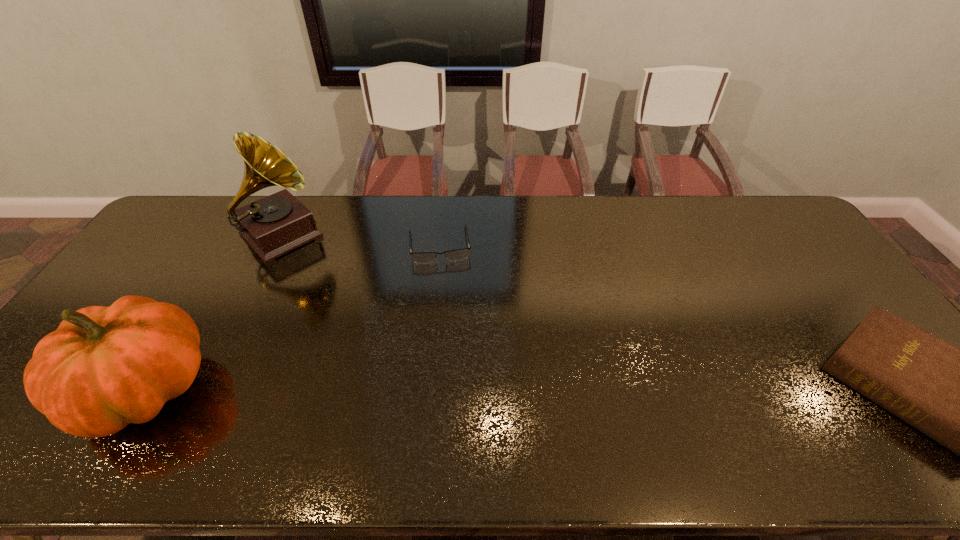
The width and height of the screenshot is (960, 540). I want to click on the third shortest object, so click(104, 367).

Locate an element on the screen. The height and width of the screenshot is (540, 960). spectacles is located at coordinates (453, 255).

Locate an element on the screen. The image size is (960, 540). the third object from left to right is located at coordinates (453, 255).

The width and height of the screenshot is (960, 540). I want to click on phonograph record, so click(279, 223).

Image resolution: width=960 pixels, height=540 pixels. Identify the location of vacant region located on the left of the second tallest object. (31, 389).

Identify the location of blank space located on the front-facing side of the spectacles. (445, 296).

Identify the location of vacant region located 0.360m on the front-facing side of the spectacles. The height and width of the screenshot is (540, 960). (452, 359).

This screenshot has height=540, width=960. What are the coordinates of `free space located on the front-facing side of the spectacles` in the screenshot? It's located at (452, 355).

In order to click on free space located from the horn of the tallest object in this screenshot , I will do `click(319, 272)`.

Where is `free space located from the horn of the tallest object`? free space located from the horn of the tallest object is located at coordinates (324, 277).